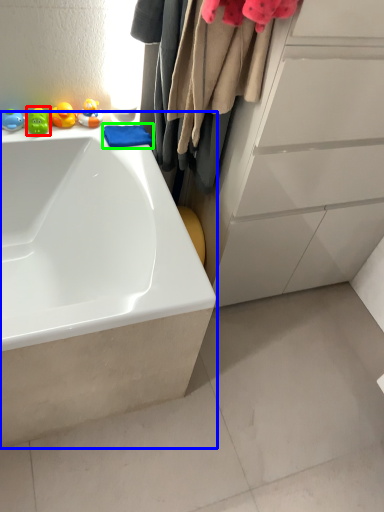
Question: Considering the real-world distances, which object is closest to toy (highlighted by a red box)? bathtub (highlighted by a blue box) or baby clothe (highlighted by a green box).

Choices:
 (A) bathtub
 (B) baby clothe

Answer: (B)